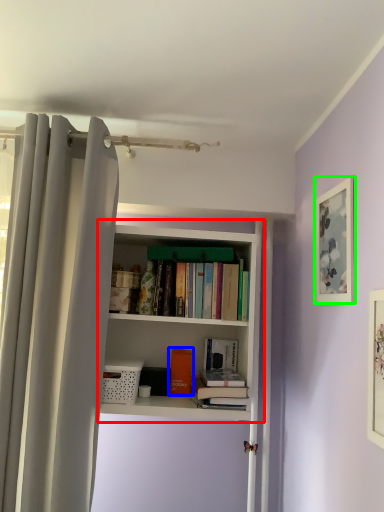
Question: Estimate the real-world distances between objects in this image. Which object is closer to bookcase (highlighted by a red box), book (highlighted by a blue box) or picture frame (highlighted by a green box)?

Choices:
 (A) book
 (B) picture frame

Answer: (A)